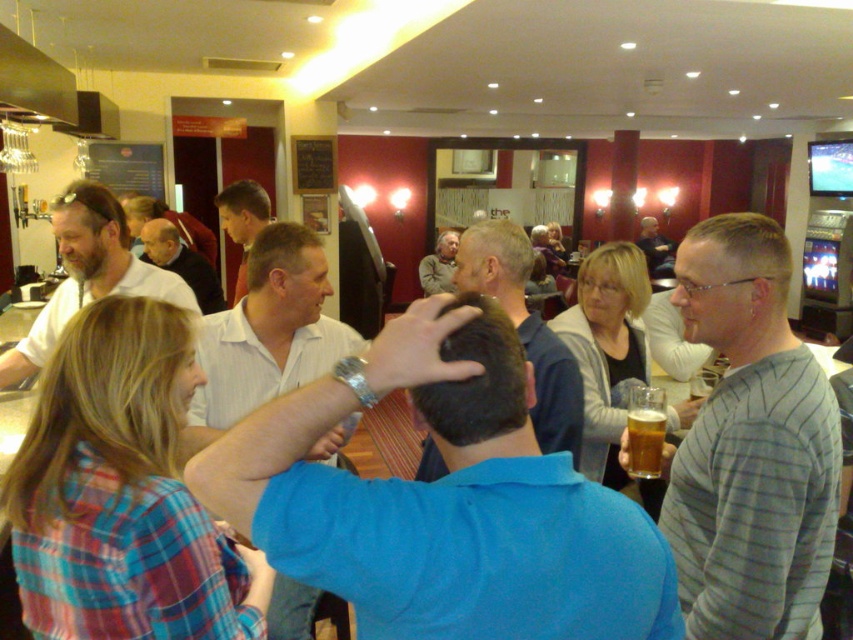
Question: Does gray sweater at center have a larger size compared to matte black jacket at center?

Choices:
 (A) no
 (B) yes

Answer: (A)

Question: Which point is farther to the camera?

Choices:
 (A) (276, 346)
 (B) (653, 426)

Answer: (A)

Question: Can you confirm if blue cotton shirt at center is positioned above gray sweater at center?

Choices:
 (A) no
 (B) yes

Answer: (A)

Question: Estimate the real-world distances between objects in this image. Which object is closer to the blue shirt at center?

Choices:
 (A) matte black jacket at center
 (B) matte white shirt at left
 (C) light brown shirt at center
 (D) golden amber liquid at center

Answer: (D)

Question: Does golden amber liquid at center appear over matte black jacket at center?

Choices:
 (A) no
 (B) yes

Answer: (A)

Question: Estimate the real-world distances between objects in this image. Which object is closer to the light brown shirt at center?

Choices:
 (A) matte black jacket at center
 (B) golden amber liquid at center

Answer: (B)